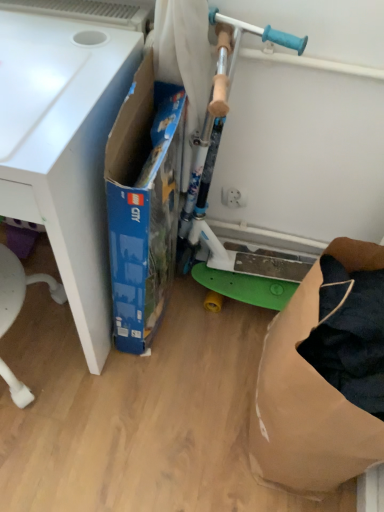
Question: Does blue cardboard box at center appear on the left side of green plastic scooter at center?

Choices:
 (A) yes
 (B) no

Answer: (A)

Question: From the image's perspective, is blue cardboard box at center over green plastic scooter at center?

Choices:
 (A) no
 (B) yes

Answer: (A)

Question: From a real-world perspective, does blue cardboard box at center stand above green plastic scooter at center?

Choices:
 (A) yes
 (B) no

Answer: (B)

Question: Are blue cardboard box at center and green plastic scooter at center far apart?

Choices:
 (A) no
 (B) yes

Answer: (A)

Question: Is the surface of blue cardboard box at center in direct contact with green plastic scooter at center?

Choices:
 (A) no
 (B) yes

Answer: (A)

Question: Is white matte desk at left bigger or smaller than brown paper bag at lower right?

Choices:
 (A) big
 (B) small

Answer: (A)

Question: Is point (11, 137) positioned closer to the camera than point (263, 425)?

Choices:
 (A) closer
 (B) farther

Answer: (A)

Question: From the image's perspective, is white matte desk at left positioned above or below brown paper bag at lower right?

Choices:
 (A) above
 (B) below

Answer: (A)

Question: Would you say white matte desk at left is inside or outside brown paper bag at lower right?

Choices:
 (A) inside
 (B) outside

Answer: (B)

Question: In terms of height, does blue cardboard box at center look taller or shorter compared to white matte desk at left?

Choices:
 (A) tall
 (B) short

Answer: (B)

Question: Which is correct: blue cardboard box at center is inside white matte desk at left, or outside of it?

Choices:
 (A) inside
 (B) outside

Answer: (B)

Question: From the image's perspective, relative to white matte desk at left, is blue cardboard box at center above or below?

Choices:
 (A) below
 (B) above

Answer: (A)

Question: Looking at their shapes, would you say blue cardboard box at center is wider or thinner than white matte desk at left?

Choices:
 (A) thin
 (B) wide

Answer: (A)

Question: From a real-world perspective, relative to brown paper bag at lower right, is blue cardboard box at center vertically above or below?

Choices:
 (A) above
 (B) below

Answer: (A)

Question: In the image, is blue cardboard box at center positioned in front of or behind brown paper bag at lower right?

Choices:
 (A) front
 (B) behind

Answer: (B)